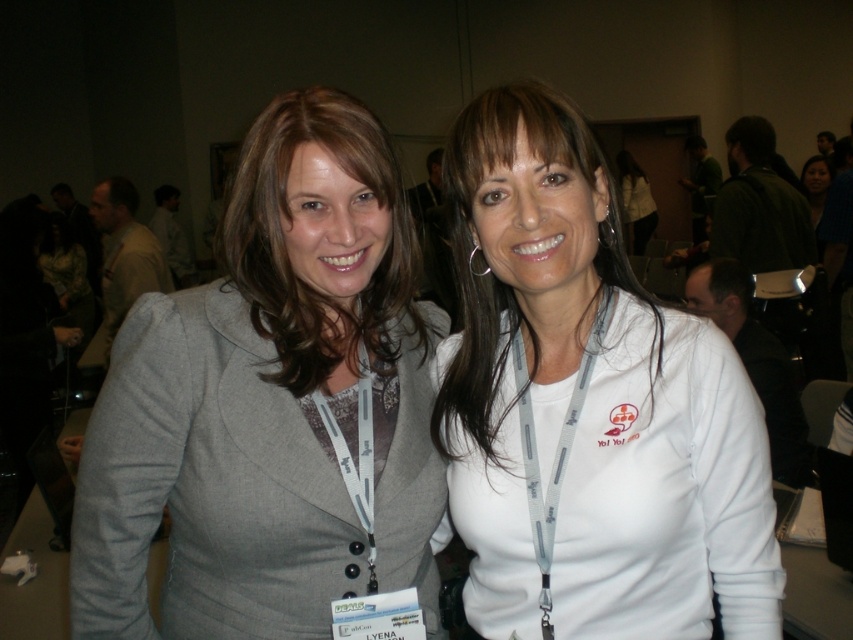
Question: Is gray fabric jacket at center above white matte shirt at center?

Choices:
 (A) no
 (B) yes

Answer: (A)

Question: Which point is farther from the camera taking this photo?

Choices:
 (A) (639, 438)
 (B) (253, 401)

Answer: (B)

Question: Can you confirm if gray fabric jacket at center is thinner than white matte shirt at center?

Choices:
 (A) no
 (B) yes

Answer: (A)

Question: Observing the image, what is the correct spatial positioning of gray fabric jacket at center in reference to white matte shirt at center?

Choices:
 (A) below
 (B) above

Answer: (A)

Question: Which point is farther to the camera?

Choices:
 (A) gray fabric jacket at center
 (B) white matte shirt at center

Answer: (A)